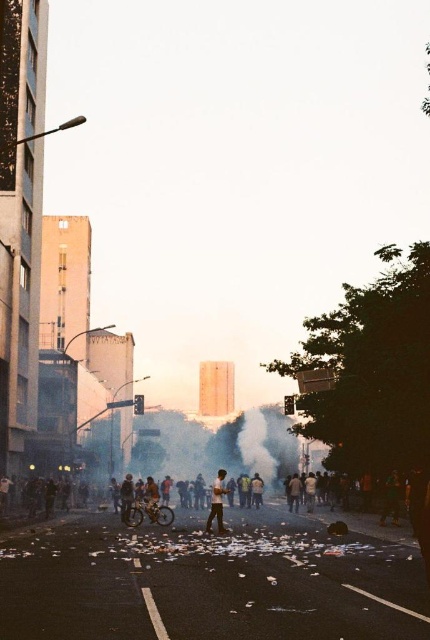
Question: Among these objects, which one is nearest to the camera?

Choices:
 (A) light brown leather jacket at center
 (B) white fog at center

Answer: (A)

Question: Which object is farther from the camera taking this photo?

Choices:
 (A) light brown leather jacket at center
 (B) white fog at center

Answer: (B)

Question: Can you confirm if white fog at center is bigger than light brown leather jacket at center?

Choices:
 (A) yes
 (B) no

Answer: (A)

Question: Is white fog at center in front of light brown leather jacket at center?

Choices:
 (A) yes
 (B) no

Answer: (B)

Question: Can you confirm if white fog at center is thinner than light brown leather jacket at center?

Choices:
 (A) no
 (B) yes

Answer: (A)

Question: Which point is closer to the camera?

Choices:
 (A) light brown leather jacket at center
 (B) white fog at center

Answer: (A)